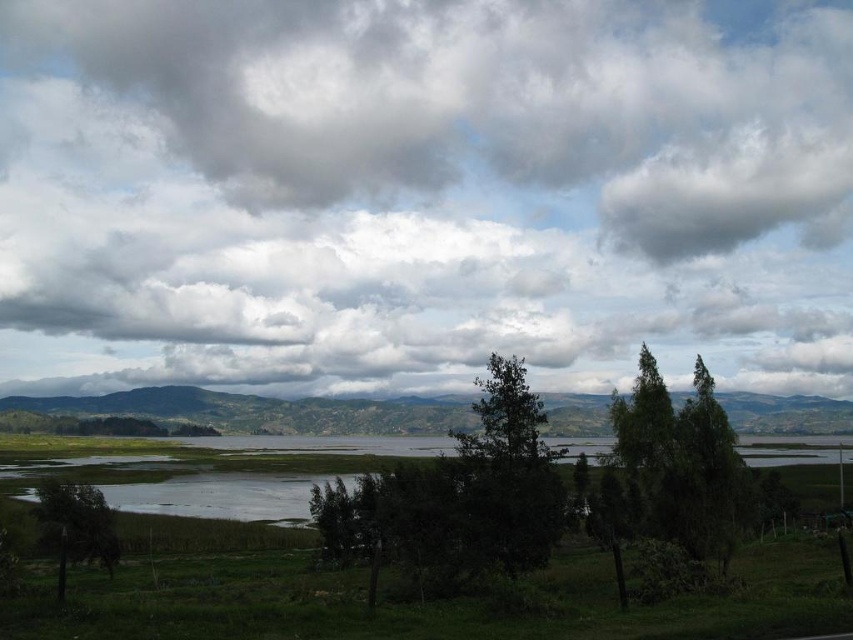
You are standing in the middle of the grassy area and want to walk towards the water. Which direction should you go to avoid the green leafy tree at lower left and the green leafy tree at right?

To avoid both the green leafy tree at lower left and the green leafy tree at right, you should head directly towards the water in the middle ground, as the green leafy tree at right is positioned to the right of the green leafy tree at lower left, leaving a clear path in the center.

You are standing in the middle of the grassy area and want to look up at the cloudy sky at upper center and the green leafy tree at right. Which one do you need to tilt your head more to see?

The cloudy sky at upper center has a greater height compared to the green leafy tree at right, so you need to tilt your head more to see the cloudy sky at upper center.

You are standing at the edge of the lake and want to walk to the green leafy tree at center. Which direction should you head relative to the green leafy tree at lower left?

The green leafy tree at center is to the right of the green leafy tree at lower left, so you should head to the right relative to the green leafy tree at lower left to reach it.